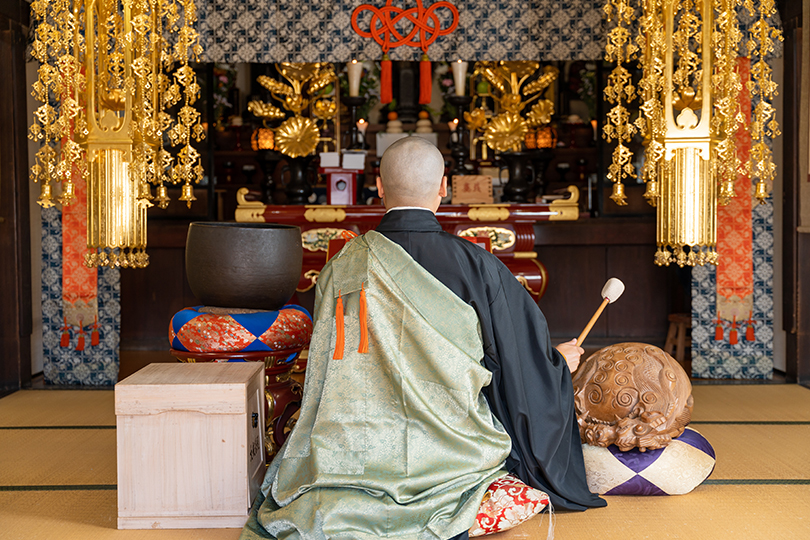
Find the location of a particular element. blue and red and gold pillow is located at coordinates (222, 329).